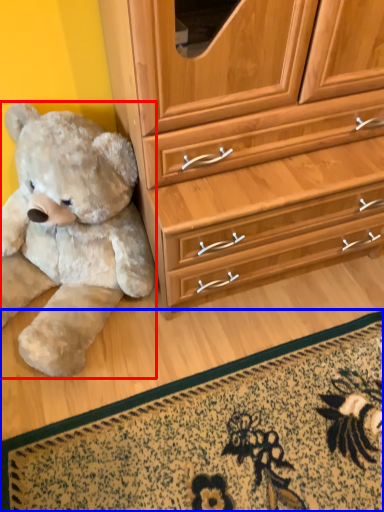
Question: Which of the following is the closest to the observer, teddy bear (highlighted by a red box) or doormat (highlighted by a blue box)?

Choices:
 (A) teddy bear
 (B) doormat

Answer: (A)